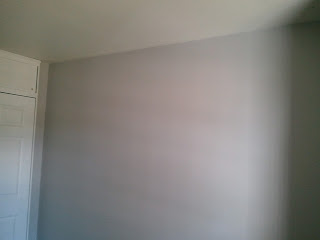
Locate an element on the screen. This screenshot has height=240, width=320. white wall is located at coordinates (193, 165).